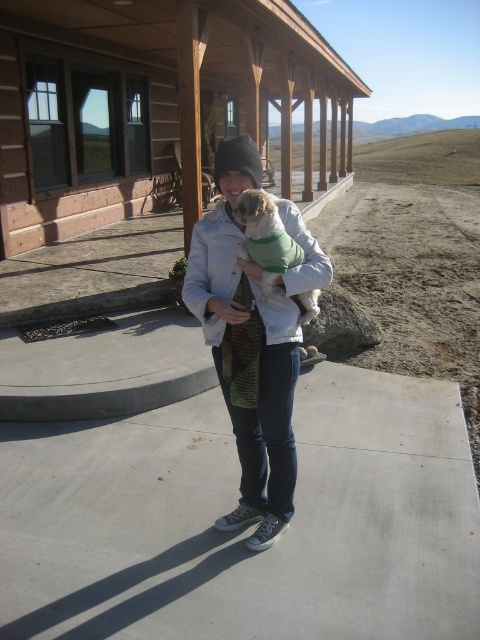
Question: Based on their relative distances, which object is farther from the denim jacket at center?

Choices:
 (A) fuzzy green sweater at center
 (B) wooden log cabin at upper center

Answer: (B)

Question: Is wooden log cabin at upper center wider than denim jacket at center?

Choices:
 (A) no
 (B) yes

Answer: (B)

Question: Does wooden log cabin at upper center have a smaller size compared to fuzzy green sweater at center?

Choices:
 (A) no
 (B) yes

Answer: (A)

Question: Is wooden log cabin at upper center above denim jacket at center?

Choices:
 (A) yes
 (B) no

Answer: (A)

Question: Which object is the closest to the fuzzy green sweater at center?

Choices:
 (A) denim jacket at center
 (B) wooden log cabin at upper center

Answer: (A)

Question: Which point is closer to the camera?

Choices:
 (A) (285, 502)
 (B) (297, 256)

Answer: (B)